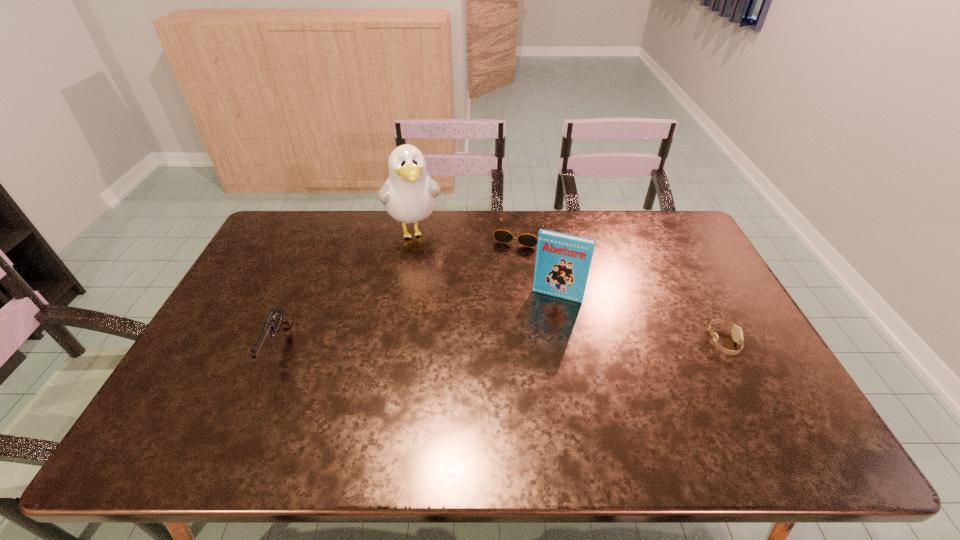
Where is `vacant space in between the third nearest object and the leftmost object`? vacant space in between the third nearest object and the leftmost object is located at coordinates (418, 321).

Where is `vacant space that's between the book and the rightmost object`? The image size is (960, 540). vacant space that's between the book and the rightmost object is located at coordinates (640, 319).

What are the coordinates of `vacant space that's between the book and the fourth object from right to left` in the screenshot? It's located at (486, 263).

Image resolution: width=960 pixels, height=540 pixels. What are the coordinates of `free space between the sunglasses and the gull` in the screenshot? It's located at (467, 232).

Image resolution: width=960 pixels, height=540 pixels. Identify the location of empty location between the second object from left to right and the leftmost object. (347, 289).

Locate which object is the third closest to the gull. Please provide its 2D coordinates. Your answer should be formatted as a tuple, i.e. [(x, y)], where the tuple contains the x and y coordinates of a point satisfying the conditions above.

[(276, 318)]

You are a GUI agent. You are given a task and a screenshot of the screen. Output one action in this format:
    pyautogui.click(x=<x>, y=<y>)
    Task: Click on the closest object to the leftmost object
    This screenshot has width=960, height=540.
    Given the screenshot: What is the action you would take?
    pyautogui.click(x=409, y=195)

Where is `free space that satisfies the following two spatial constraints: 1. on the front side of the second object from left to right; 2. on the left side of the sunglasses`? The height and width of the screenshot is (540, 960). free space that satisfies the following two spatial constraints: 1. on the front side of the second object from left to right; 2. on the left side of the sunglasses is located at coordinates (414, 234).